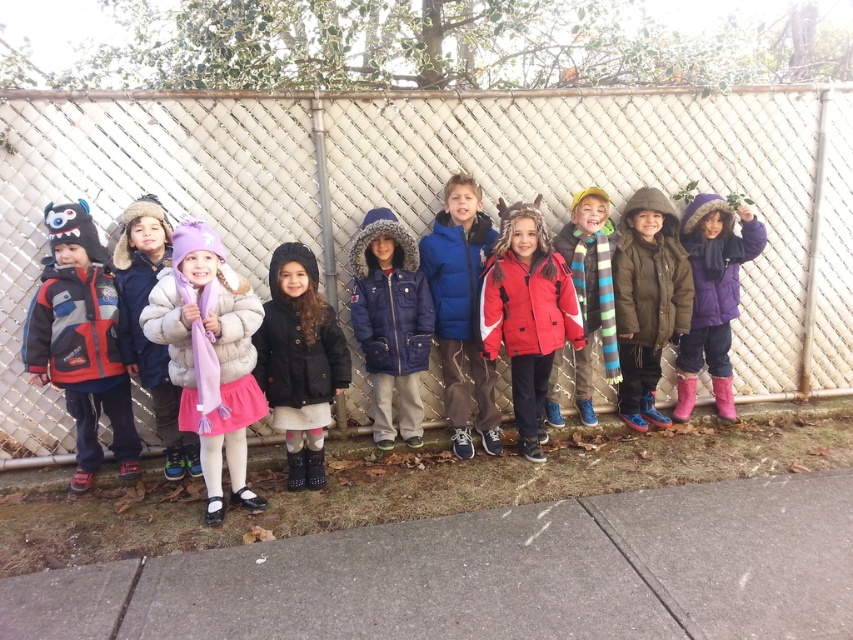
You are a photographer trying to capture a clear shot of the matte red and blue jacket at left and the striped scarf at center. Since you want to focus on the smaller object, which one should you zoom in on?

The striped scarf at center is smaller than the matte red and blue jacket at left, so you should zoom in on the striped scarf at center to focus on the smaller object.

You are a photographer trying to capture a clear shot of both the matte brown jacket at center and the blue puffy jacket at center. Which jacket will appear closer to the camera in the photo?

The matte brown jacket at center will appear closer to the camera because it is positioned further to the viewer than the blue puffy jacket at center.

You are a photographer trying to capture a photo of the matte red and blue jacket at left and the striped scarf at center. Since you want to ensure both are visible in the frame, which object should you focus on first to account for their sizes?

The matte red and blue jacket at left is taller than the striped scarf at center, so you should focus on the matte red and blue jacket at left first to ensure its full height is captured before adjusting the frame for the smaller striped scarf at center.